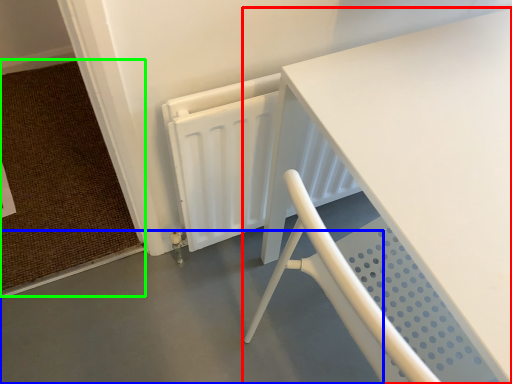
Question: Based on their relative distances, which object is farther from table (highlighted by a red box)? Choose from concrete (highlighted by a blue box) and doormat (highlighted by a green box).

Choices:
 (A) concrete
 (B) doormat

Answer: (B)